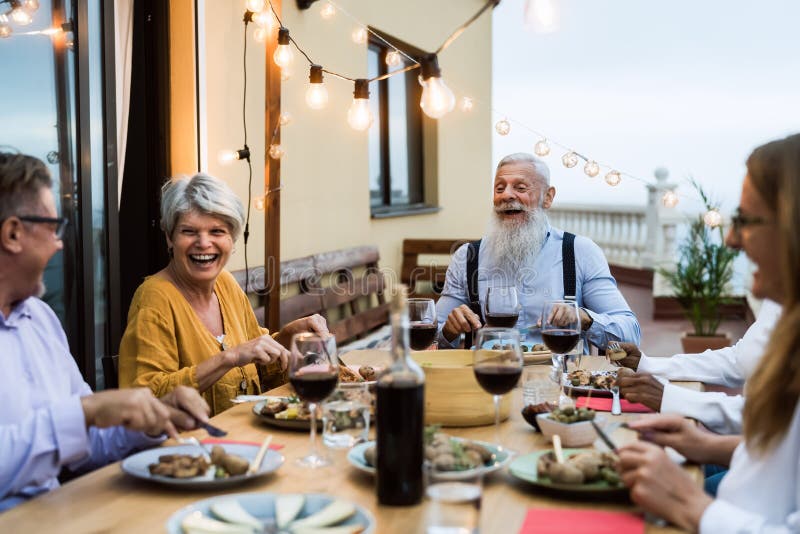
What are the coordinates of `plate` in the screenshot? It's located at (312, 515), (232, 479), (289, 418), (450, 460), (536, 468), (597, 383), (530, 349).